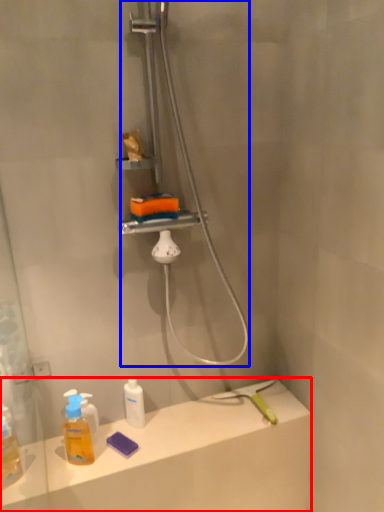
Question: Which point is closer to the camera, counter top (highlighted by a red box) or shower (highlighted by a blue box)?

Choices:
 (A) counter top
 (B) shower

Answer: (B)